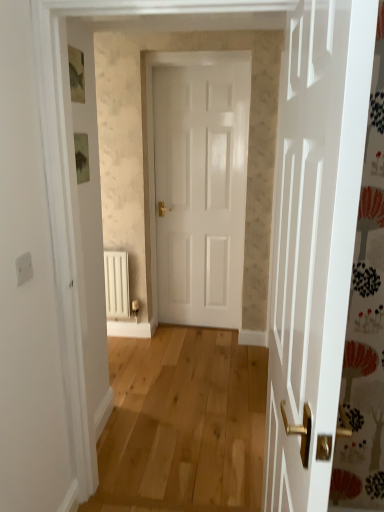
Question: In terms of size, does white glossy door at center appear bigger or smaller than white matte radiator at lower left?

Choices:
 (A) big
 (B) small

Answer: (A)

Question: Relative to white matte radiator at lower left, is white glossy door at center in front or behind?

Choices:
 (A) front
 (B) behind

Answer: (A)

Question: Is point (153, 61) positioned closer to the camera than point (109, 286)?

Choices:
 (A) closer
 (B) farther

Answer: (A)

Question: Is white matte radiator at lower left in front of or behind white glossy door at center in the image?

Choices:
 (A) behind
 (B) front

Answer: (A)

Question: From a real-world perspective, is white matte radiator at lower left positioned above or below white glossy door at center?

Choices:
 (A) below
 (B) above

Answer: (A)

Question: In terms of size, does white matte radiator at lower left appear bigger or smaller than white glossy door at center?

Choices:
 (A) small
 (B) big

Answer: (A)

Question: Is white matte radiator at lower left taller or shorter than white glossy door at center?

Choices:
 (A) short
 (B) tall

Answer: (A)